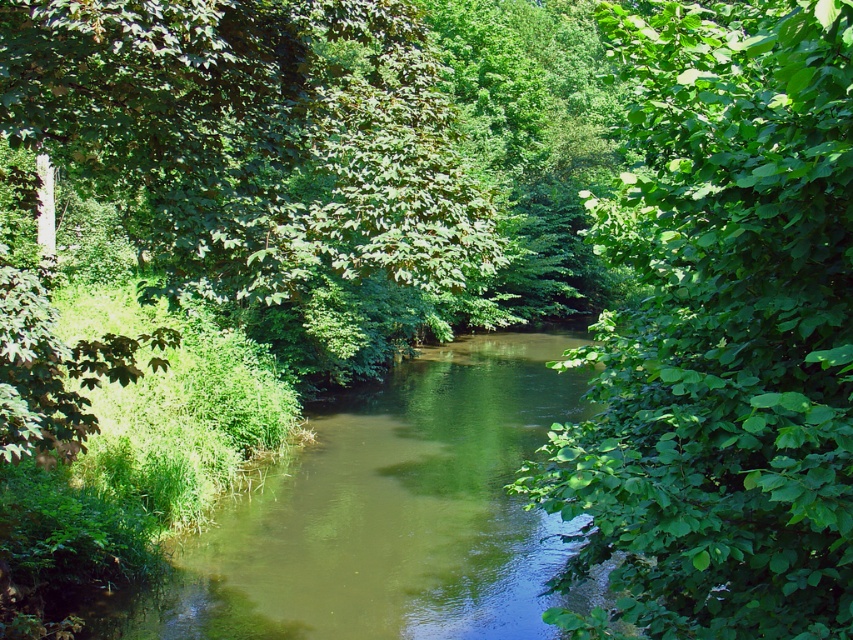
Question: Is green leafy tree at center right smaller than green smooth water at center?

Choices:
 (A) yes
 (B) no

Answer: (B)

Question: Which object appears closest to the camera in this image?

Choices:
 (A) green leafy tree at upper left
 (B) green smooth water at center

Answer: (A)

Question: Observing the image, what is the correct spatial positioning of green leafy tree at center right in reference to green leafy tree at upper left?

Choices:
 (A) right
 (B) left

Answer: (A)

Question: Which of the following is the farthest from the observer?

Choices:
 (A) pos(409,477)
 (B) pos(682,609)
 (C) pos(198,6)

Answer: (A)

Question: Is green leafy tree at center right above green leafy tree at upper left?

Choices:
 (A) no
 (B) yes

Answer: (B)

Question: Which is nearer to the green leafy tree at upper left?

Choices:
 (A) green leafy tree at center right
 (B) green smooth water at center

Answer: (A)